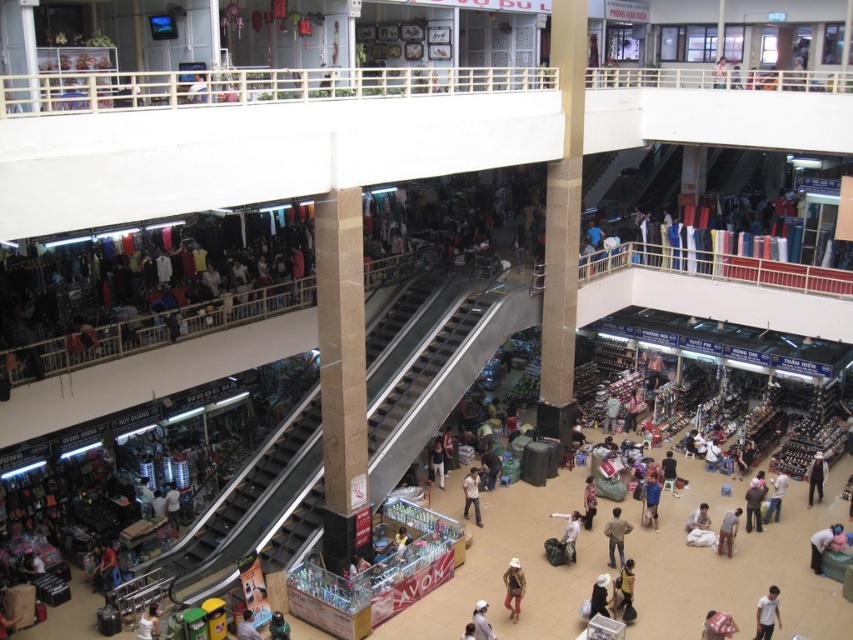
Question: Which point is farther to the camera?

Choices:
 (A) pyautogui.click(x=811, y=458)
 (B) pyautogui.click(x=479, y=508)
 (C) pyautogui.click(x=514, y=577)
 (D) pyautogui.click(x=691, y=541)

Answer: (A)

Question: From the image, what is the correct spatial relationship of metallic silver escalator at center in relation to light brown fabric shirt at lower left?

Choices:
 (A) right
 (B) left

Answer: (A)

Question: Among these points, which one is farthest from the camera?

Choices:
 (A) (144, 618)
 (B) (521, 573)
 (C) (440, 476)
 (D) (717, 636)

Answer: (C)

Question: Which of the following is the closest to the observer?

Choices:
 (A) light brown fabric shirt at center
 (B) light brown fabric shirt at lower left
 (C) light brown fabric shirt at lower right
 (D) dark blue jeans at center

Answer: (C)

Question: From the image, what is the correct spatial relationship of light brown fabric bag at center in relation to patterned fabric shirt at center?

Choices:
 (A) left
 (B) right

Answer: (A)

Question: Is light brown fabric shirt at lower right thinner than khaki fabric pants at center?

Choices:
 (A) yes
 (B) no

Answer: (B)